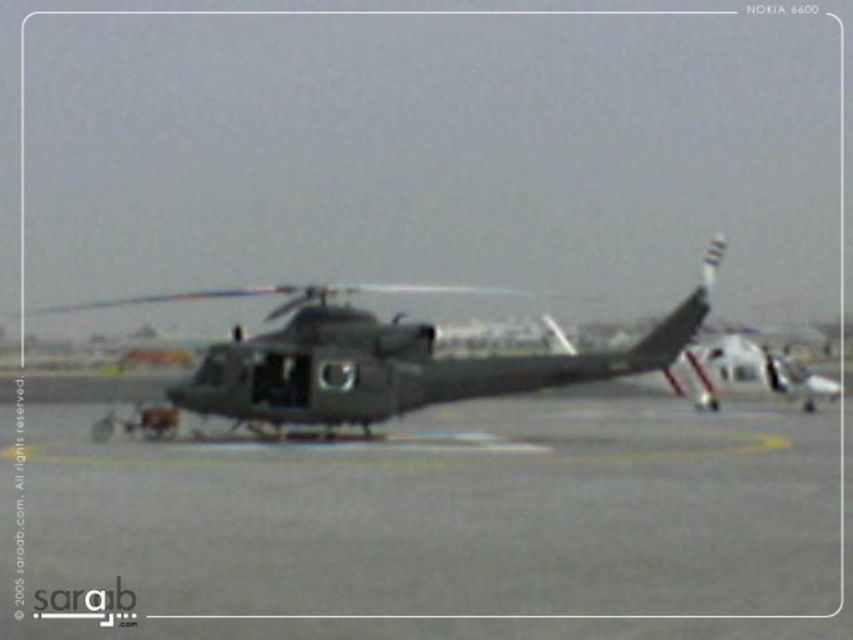
Looking at this image, can you confirm if gray asphalt tarmac at center is thinner than dark gray matte helicopter at center?

Yes, gray asphalt tarmac at center is thinner than dark gray matte helicopter at center.

Between gray asphalt tarmac at center and dark gray matte helicopter at center, which one has less height?

With less height is gray asphalt tarmac at center.

What do you see at coordinates (450, 522) in the screenshot? I see `gray asphalt tarmac at center` at bounding box center [450, 522].

Image resolution: width=853 pixels, height=640 pixels. Identify the location of gray asphalt tarmac at center. click(450, 522).